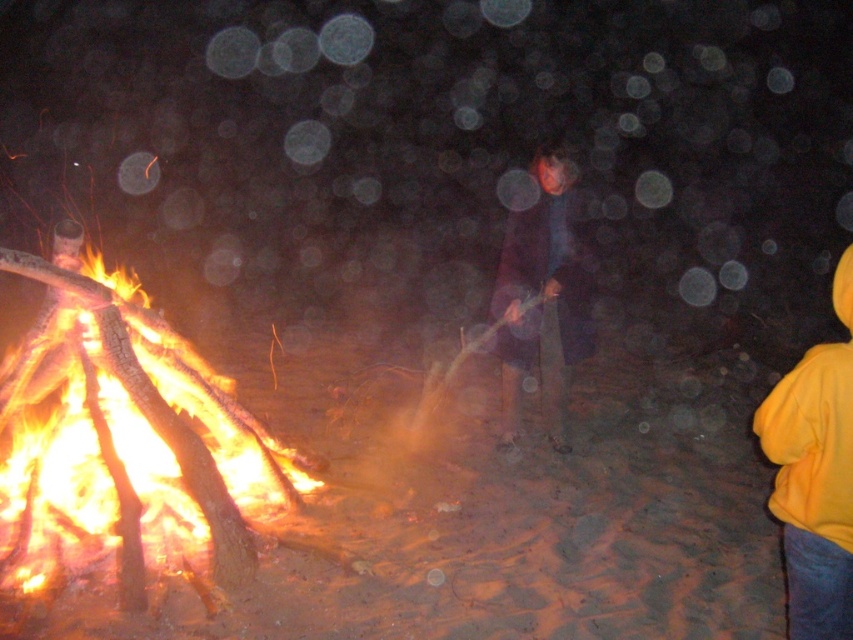
You are a photographer trying to capture the perfect shot of the campfire scene. You want to include the yellow fleece jacket at lower right in your composition. Based on its position, where should you aim your camera to ensure it is centered in the frame?

The yellow fleece jacket at lower right is located at point 0.745 on the x axis and 0.957 on the y axis. To center it, aim your camera so the crosshairs align with those coordinates.

You are a photographer setting up a shot of the nighttime scene. You want to position your camera so that the flaming wood fire at left and the dark blue fabric at center are both visible in the frame. Which object should you place on the left side of the camera frame?

The flaming wood fire at left should be placed on the left side of the camera frame since it is to the left of the dark blue fabric at center according to the description.

You are standing in front of the campfire and see two points in the scene, one at point coordinates point (21, 422) and the other at point coordinates point (796, 500). Which point is closer to you?

Point (21, 422) is further to the camera than point (796, 500), so the point closer to you is point (796, 500).